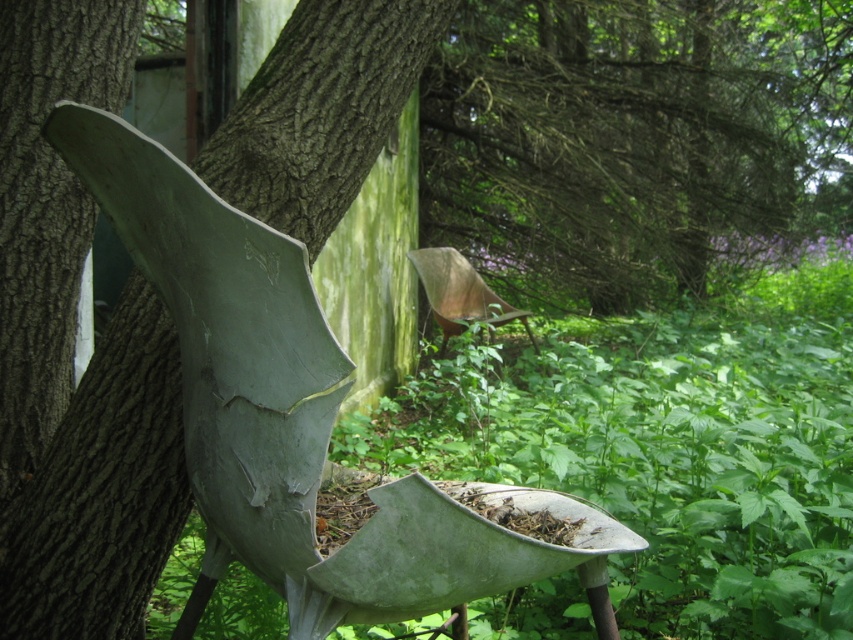
You are standing in the garden and want to place a new bench that is 1.5 meters long. The point where you want to place it is exactly at point (283, 227). Can you fit the bench there?

The point (283, 227) is 1.87 meters from the viewer. Since the bench is 1.5 meters long, it can fit at that point as the distance is sufficient.

You are standing in the garden and want to take a photo of the large metallic sculpture. To ensure the green rough bark tree trunk at left is not blocking the view, where should you position yourself relative to the sculpture?

Position yourself to the right of the sculpture so that the green rough bark tree trunk at left is out of the frame.

You are standing in a garden and see a large metallic sculpture resembling a bird or fish. There is a point marked at coordinates (102, 490). What object is located at that point?

The point at (102, 490) is where the green rough bark tree trunk at left is located.